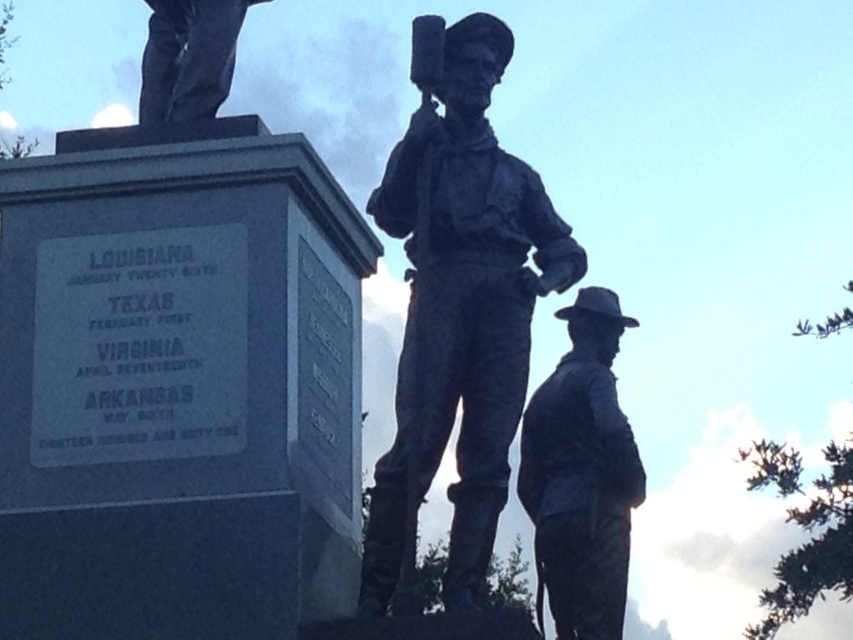
Which is behind, point (456, 118) or point (540, 522)?

Positioned behind is point (540, 522).

The width and height of the screenshot is (853, 640). Identify the location of bronze statue at center. (459, 304).

Which is behind, point (519, 280) or point (561, 580)?

The point (561, 580) is more distant.

Locate an element on the screen. The height and width of the screenshot is (640, 853). bronze statue at center is located at coordinates (459, 304).

Between bronze statue at center and polished bronze statue at upper left, which one appears on the left side from the viewer's perspective?

From the viewer's perspective, polished bronze statue at upper left appears more on the left side.

Image resolution: width=853 pixels, height=640 pixels. What do you see at coordinates (459, 304) in the screenshot? I see `bronze statue at center` at bounding box center [459, 304].

Which is in front, point (523, 237) or point (161, 81)?

Point (523, 237)

The image size is (853, 640). What are the coordinates of `bronze statue at center` in the screenshot? It's located at (459, 304).

Is point (534, 492) positioned in front of point (149, 19)?

That is True.

Does bronze statue at lower right appear on the right side of polished bronze statue at upper left?

Yes, bronze statue at lower right is to the right of polished bronze statue at upper left.

Is point (595, 484) closer to camera compared to point (224, 26)?

Yes, it is.

Where is `bronze statue at lower right`? bronze statue at lower right is located at coordinates (581, 474).